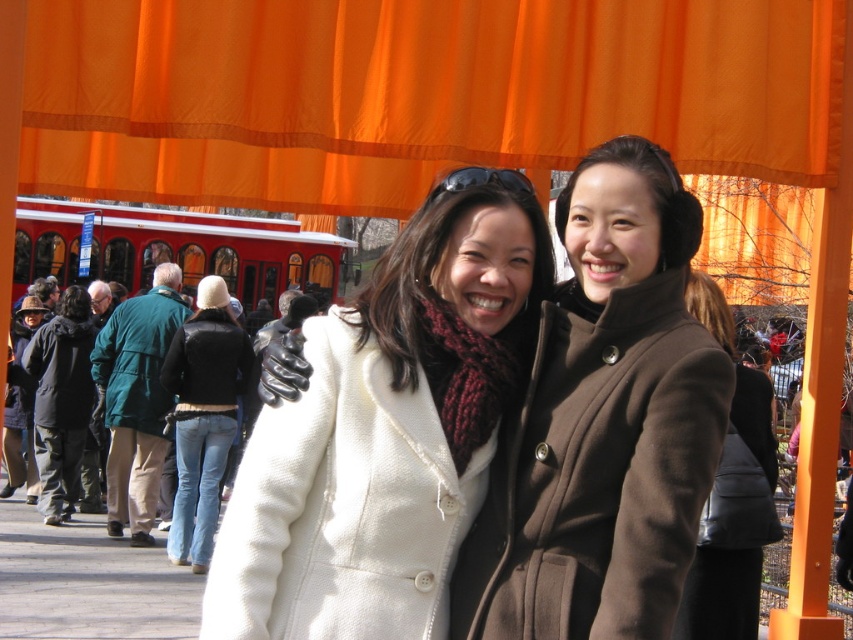
You are a photographer standing 3 meters away from the orange fabric curtain at upper center. You want to take a photo of two people who are 9.77 meters apart. Can you fit both of them in the frame if your camera has a 50mm lens?

The two people are 9.77 meters apart, so with a 50mm lens, the photographer can fit both of them in the frame since the distance between them is within the lens coverage.

You are a photographer trying to capture a clear shot of the brown wool coat at center without the orange fabric curtain at upper center blocking the view. Which direction should you move the camera to achieve this?

The orange fabric curtain at upper center is above the brown wool coat at center. To avoid the curtain blocking the view, move the camera downward so that the lens points lower, focusing on the brown wool coat at center while positioning the orange fabric curtain at upper center out of the frame.

You are a photographer trying to capture a group photo of the two people in the scene. The photographer wants to ensure that both the brown woolen coat at center and the brown wool coat at center are clearly visible in the photo. Based on their spatial relationship, which coat should be positioned closer to the camera to ensure both are visible without overlapping?

The brown woolen coat at center occupies less space than the brown wool coat at center, so positioning the brown wool coat at center closer to the camera would allow both coats to be visible without overlapping.